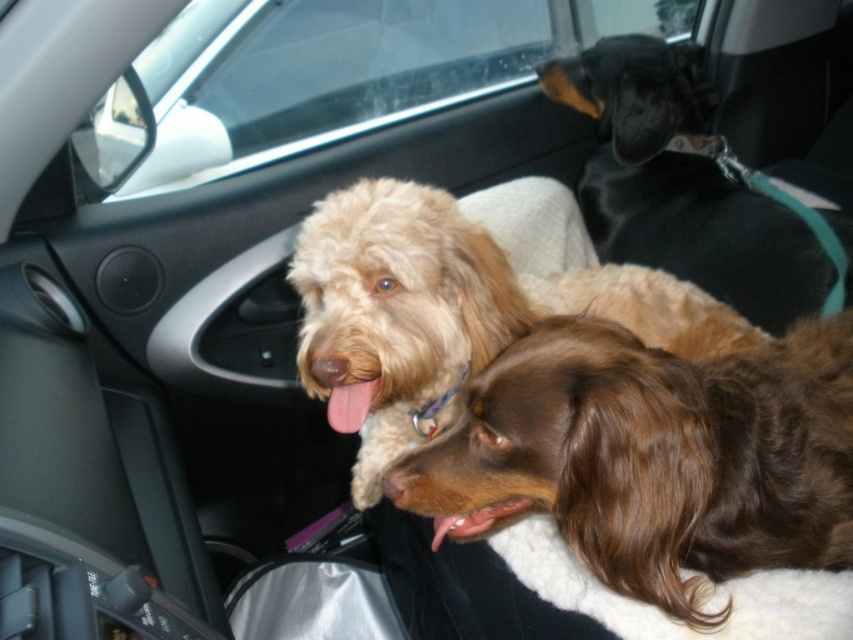
Can you confirm if light brown fur at center is bigger than black leather dog at upper right?

Actually, light brown fur at center might be smaller than black leather dog at upper right.

Does point (415, 253) lie behind point (675, 104)?

No, (415, 253) is closer to viewer.

Locate an element on the screen. The height and width of the screenshot is (640, 853). light brown fur at center is located at coordinates (448, 312).

Does brown silky dog at center come behind transparent glass car window at upper center?

No, it is not.

In order to click on brown silky dog at center in this screenshot , I will do `click(653, 458)`.

Between point (351, 104) and point (717, 292), which one is positioned behind?

The point (351, 104) is behind.

Find the location of a particular element. transparent glass car window at upper center is located at coordinates (351, 70).